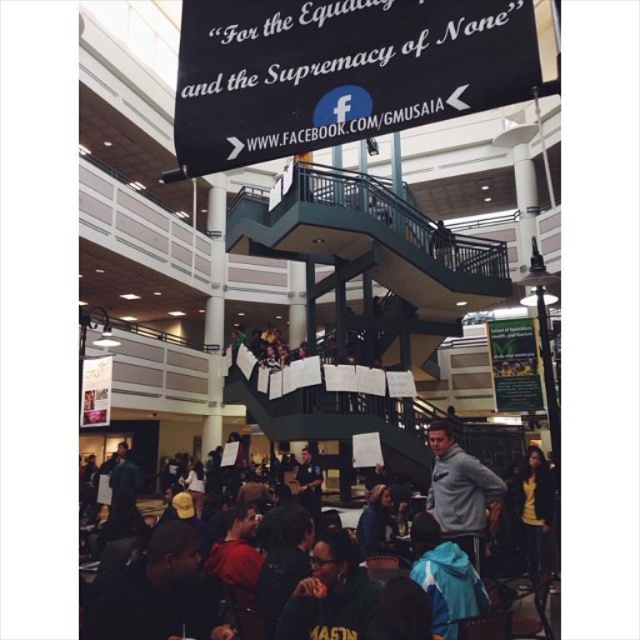
Question: Does green jersey at lower center have a lesser width compared to gray fleece sweatshirt at lower right?

Choices:
 (A) yes
 (B) no

Answer: (A)

Question: Among these points, which one is nearest to the camera?

Choices:
 (A) (92, 604)
 (B) (394, 44)
 (C) (506, 589)
 (D) (467, 522)

Answer: (B)

Question: Which point is farther to the camera?

Choices:
 (A) (150, 548)
 (B) (538, 588)
 (C) (291, 131)

Answer: (B)

Question: Can you confirm if green jersey at lower center is positioned to the left of gray fleece sweatshirt at lower right?

Choices:
 (A) yes
 (B) no

Answer: (A)

Question: Among these points, which one is farthest from the camera?

Choices:
 (A) pos(216,582)
 (B) pos(339,621)

Answer: (A)

Question: Can you confirm if black fabric sign at upper center is bigger than green jersey at lower center?

Choices:
 (A) yes
 (B) no

Answer: (A)